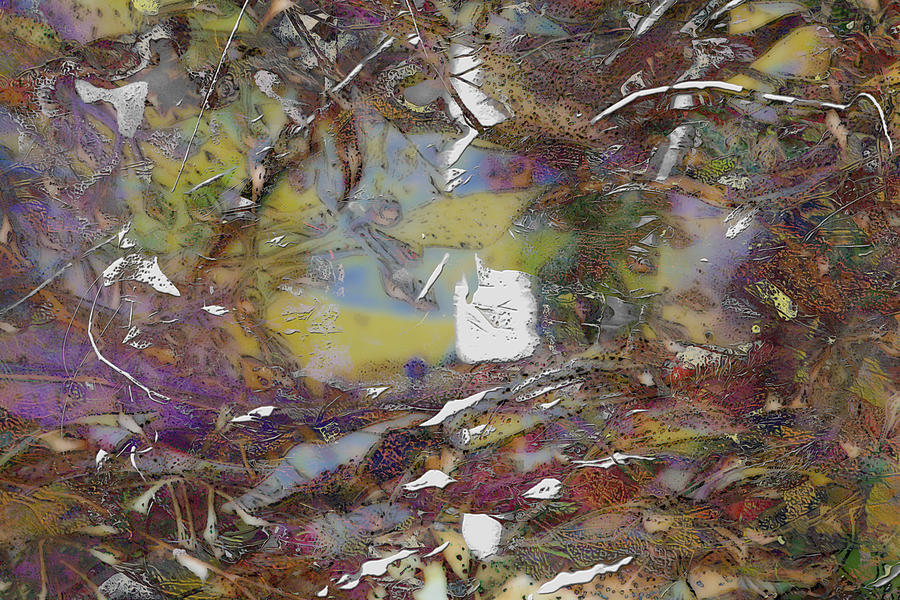
The height and width of the screenshot is (600, 900). I want to click on bottom right edge of painting, so click(892, 595).